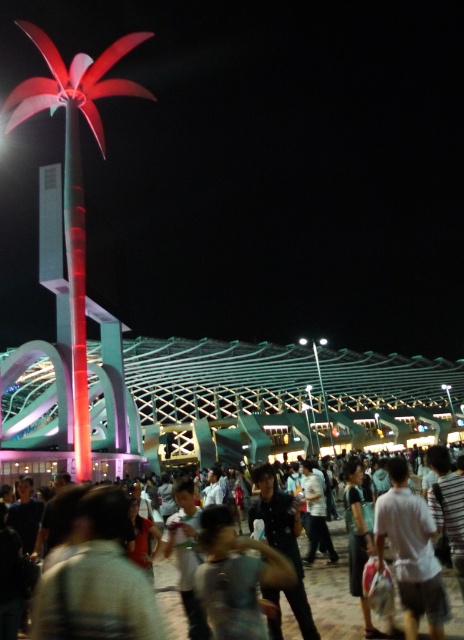
Question: Based on their relative distances, which object is nearer to the matte black crowd at center?

Choices:
 (A) white matte shirt at lower right
 (B) shiny metallic palm tree at left

Answer: (A)

Question: Which point appears farthest from the camera in this image?

Choices:
 (A) (64, 224)
 (B) (456, 618)
 (C) (405, 541)

Answer: (A)

Question: Can you confirm if shiny metallic palm tree at left is thinner than white matte shirt at lower right?

Choices:
 (A) yes
 (B) no

Answer: (B)

Question: Is shiny metallic palm tree at left below white matte shirt at lower right?

Choices:
 (A) yes
 (B) no

Answer: (B)

Question: Which point is farther to the camera?

Choices:
 (A) (166, 604)
 (B) (81, 448)

Answer: (B)

Question: From the image, what is the correct spatial relationship of shiny metallic palm tree at left in relation to matte black crowd at center?

Choices:
 (A) right
 (B) left

Answer: (B)